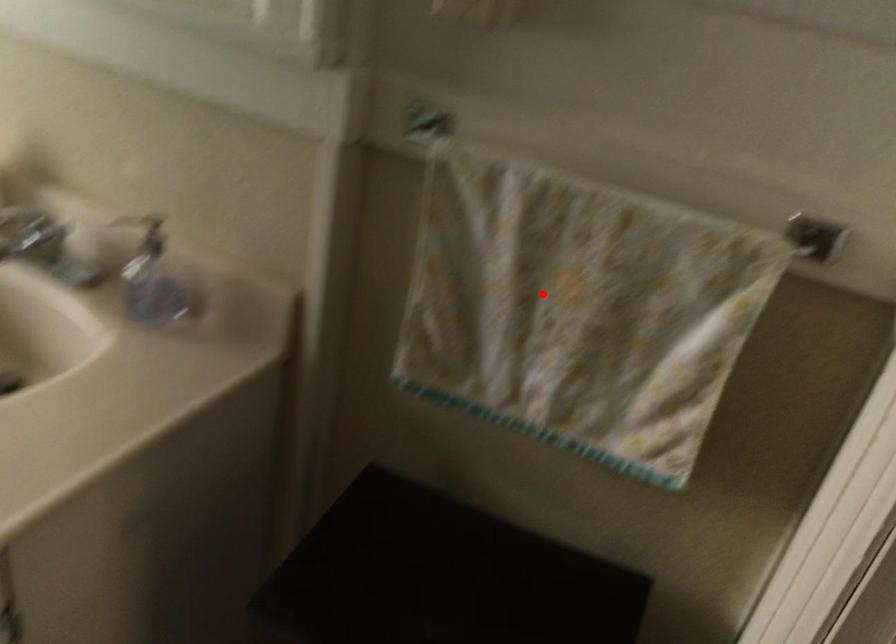
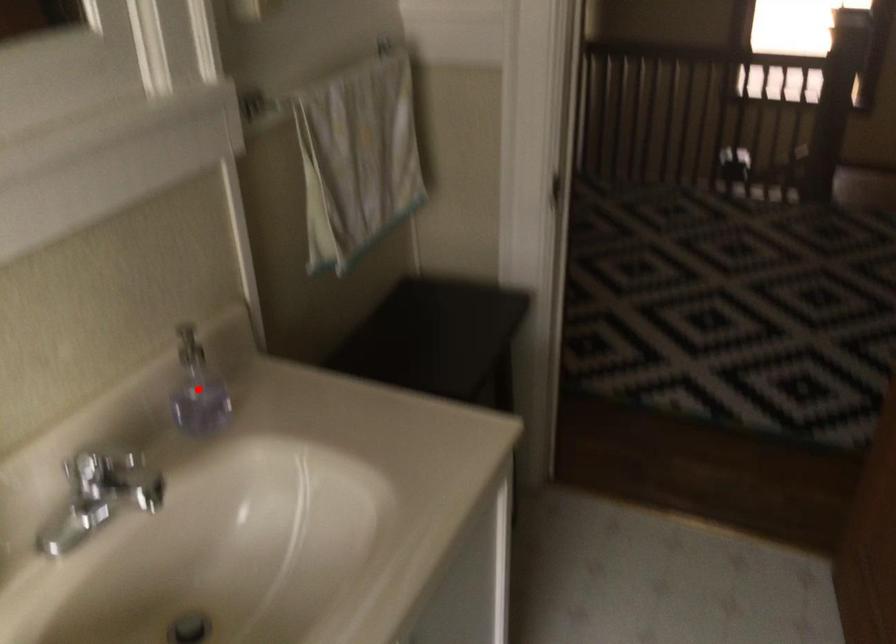
I am providing you with two images of the same scene from different viewpoints. A red point is marked on the first image and another point is marked on the second image. Do the highlighted points in image1 and image2 indicate the same real-world spot?

No